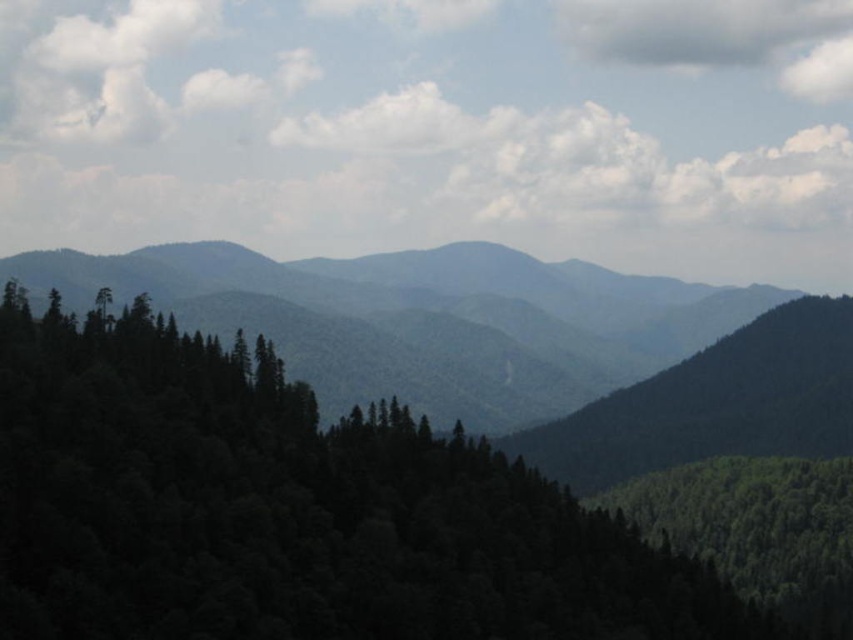
You are a hiker planning to take a photo of the green textured forest at center and the gray fluffy cloud at upper right. Which object should you focus on first if you want to capture both in a single frame without moving the camera?

The green textured forest at center is wider than the gray fluffy cloud at upper right, so you should focus on the wider green textured forest at center first to ensure it fits in the frame before adjusting for the smaller gray fluffy cloud at upper right.

You are an airplane pilot flying at a high altitude. You notice two clouds in the sky ahead of you. The white fluffy cloud at upper center and the gray fluffy cloud at upper right. Which cloud is higher in the sky?

The white fluffy cloud at upper center is taller than the gray fluffy cloud at upper right, so the white fluffy cloud at upper center is higher in the sky.